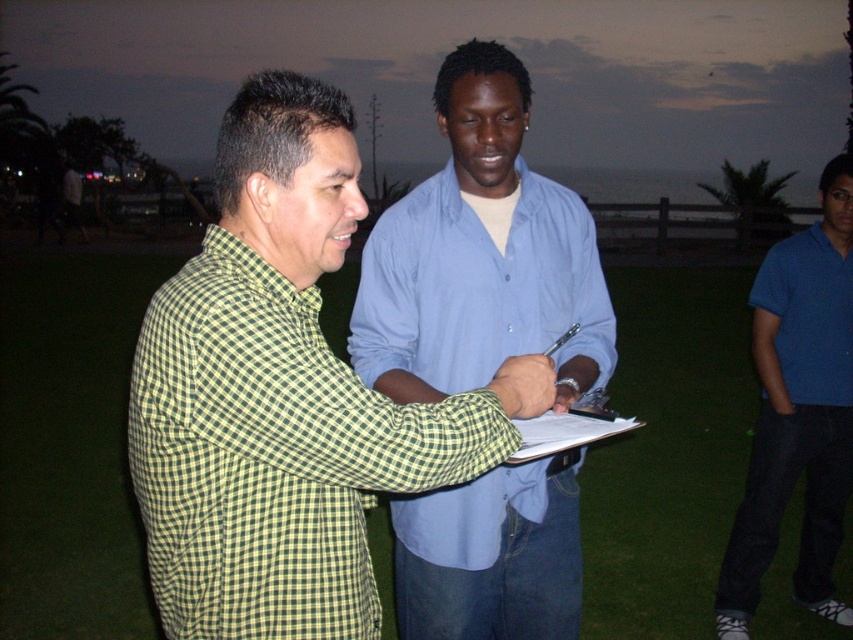
Question: Is blue cotton shirt at center thinner than white paper at center?

Choices:
 (A) no
 (B) yes

Answer: (A)

Question: Which point is farther to the camera?

Choices:
 (A) (221, 548)
 (B) (555, 248)
 (C) (520, 422)

Answer: (B)

Question: Among these points, which one is farthest from the camera?

Choices:
 (A) (413, 332)
 (B) (793, 288)
 (C) (216, 182)
 (D) (776, 493)

Answer: (B)

Question: Does blue cotton shirt at right come in front of blue cotton polo shirt at right?

Choices:
 (A) no
 (B) yes

Answer: (B)

Question: Which point appears farthest from the camera in this image?

Choices:
 (A) (537, 433)
 (B) (334, 529)
 (C) (769, 291)

Answer: (C)

Question: Is blue cotton shirt at center to the left of blue cotton shirt at right from the viewer's perspective?

Choices:
 (A) no
 (B) yes

Answer: (B)